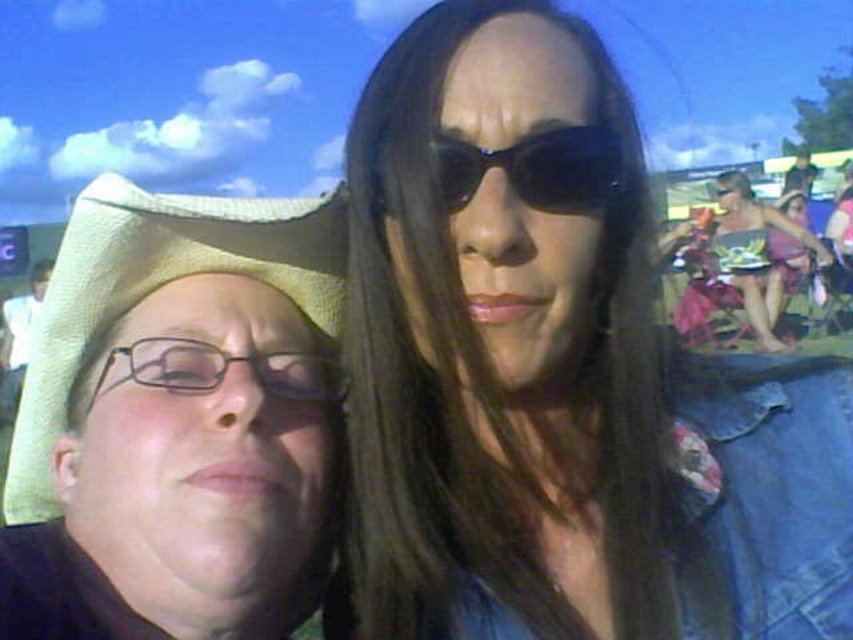
Is shiny black sunglasses at center thinner than black shiny sunglasses at center?

No.

Does point (827, 497) come behind point (454, 157)?

Yes, point (827, 497) is farther from viewer.

Who is more forward, (515, 22) or (601, 163)?

Point (601, 163) is more forward.

Find the location of a particular element. The height and width of the screenshot is (640, 853). shiny black sunglasses at center is located at coordinates tap(560, 372).

Between point (152, 205) and point (444, 147), which one is positioned in front?

Point (444, 147) is more forward.

Identify the location of yellow straw hat at left. (154, 289).

Which of these two, black shiny sunglasses at center or clear plastic glasses at center, stands taller?

With more height is black shiny sunglasses at center.

Does black shiny sunglasses at center have a greater height compared to clear plastic glasses at center?

Yes.

Is point (450, 164) less distant than point (314, 397)?

Yes, it is.

Locate an element on the screen. The image size is (853, 640). black shiny sunglasses at center is located at coordinates (535, 168).